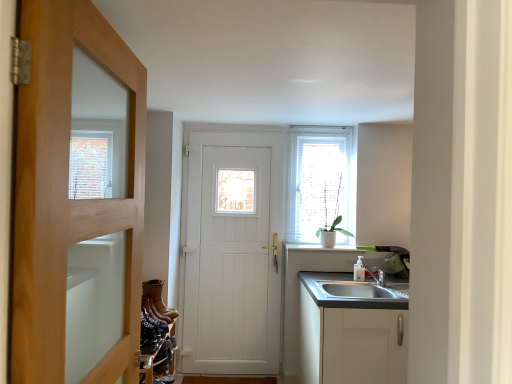
Locate an element on the screen. The height and width of the screenshot is (384, 512). free space above white wooden door at center, which appears as the second door when viewed from the front (from a real-world perspective) is located at coordinates (241, 126).